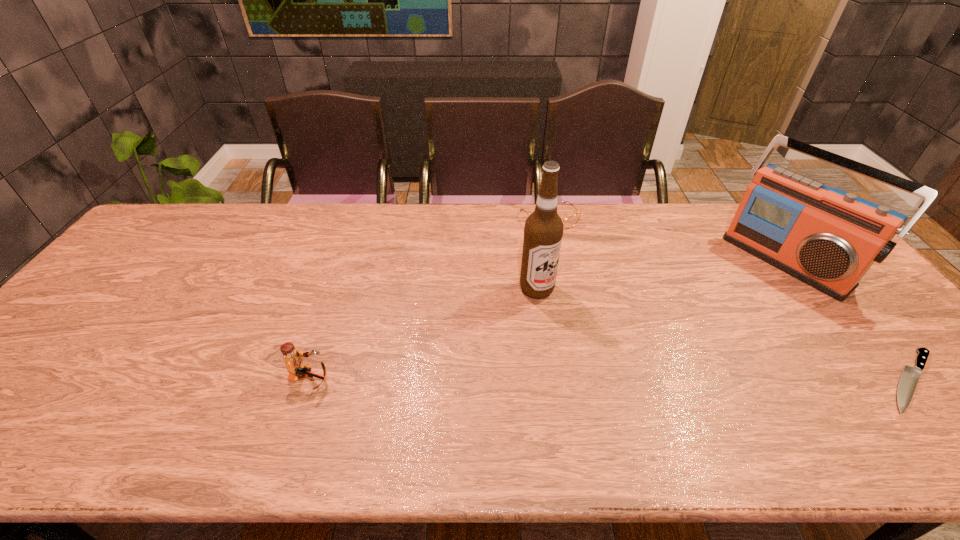
What are the coordinates of `vacant space on the desktop that is between the Lego and the shortest object and is positioned on the front-facing side of the spectacles` in the screenshot? It's located at (666, 380).

The image size is (960, 540). I want to click on vacant space on the desktop that is between the third shortest object and the steak knife and is positioned on the label of the alcohol, so [x=669, y=380].

I want to click on free space on the desktop that is between the leftmost object and the steak knife and is positioned on the front-facing side of the radio receiver, so click(x=636, y=380).